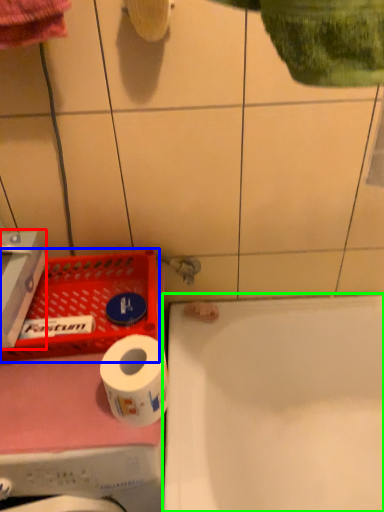
Question: Considering the real-world distances, which object is farthest from carton (highlighted by a red box)? laundry basket (highlighted by a blue box) or bathtub (highlighted by a green box)?

Choices:
 (A) laundry basket
 (B) bathtub

Answer: (B)